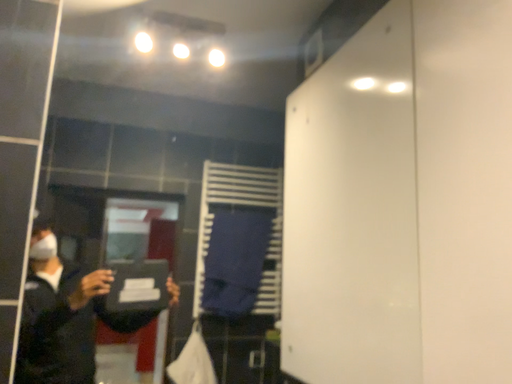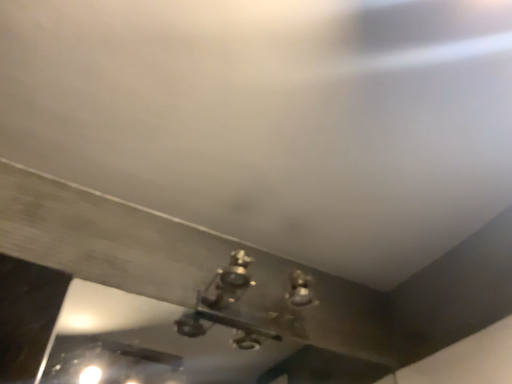
Question: Which way did the camera rotate in the video?

Choices:
 (A) rotated left
 (B) rotated right

Answer: (B)